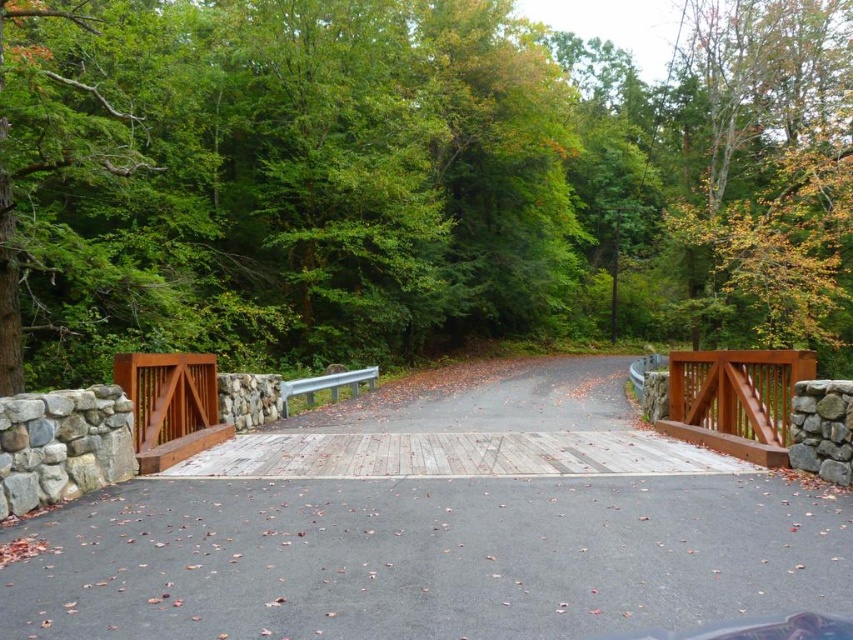
Question: Is smooth reddish-brown wooden gate at center to the right of brown wooden gate at center-left from the viewer's perspective?

Choices:
 (A) yes
 (B) no

Answer: (A)

Question: Among these points, which one is nearest to the camera?

Choices:
 (A) (142, 378)
 (B) (820, 54)

Answer: (A)

Question: Does green leafy tree at upper center have a greater width compared to brown wooden gate at center-left?

Choices:
 (A) yes
 (B) no

Answer: (A)

Question: Which point appears closest to the camera in this image?

Choices:
 (A) (776, 422)
 (B) (196, 419)

Answer: (A)

Question: Which object is farther from the camera taking this photo?

Choices:
 (A) smooth reddish-brown wooden gate at center
 (B) brown wooden gate at center-left

Answer: (A)

Question: Is green leafy tree at upper center to the left of smooth reddish-brown wooden gate at center from the viewer's perspective?

Choices:
 (A) yes
 (B) no

Answer: (B)